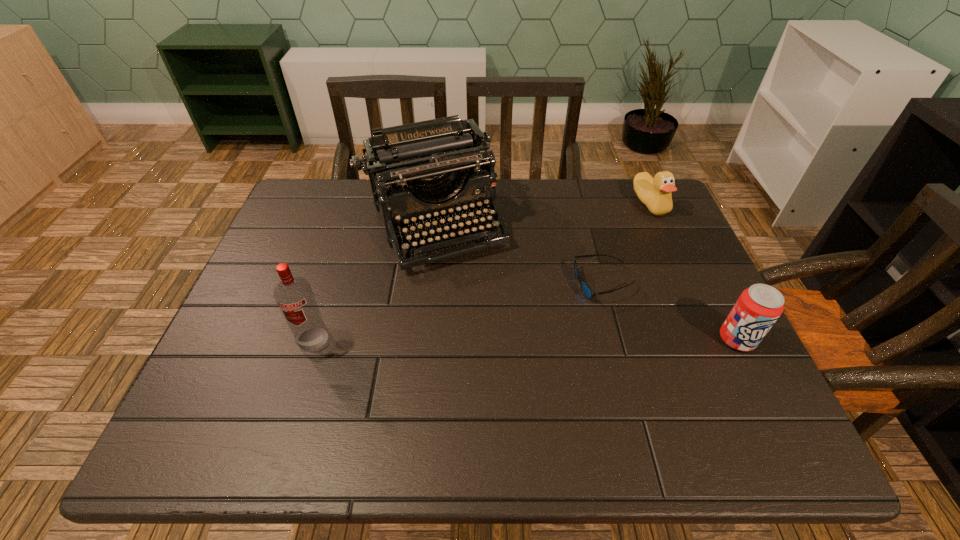
Locate an element on the screen. vacant spot on the desktop that is between the vodka and the soda can and is positioned at the beak of the second shortest object is located at coordinates (572, 339).

At what (x,y) coordinates should I click in order to perform the action: click on free space on the desktop that is between the vodka and the soda can and is positioned on the typing side of the typewriter. Please return your answer as a coordinate pair (x, y). This screenshot has height=540, width=960. Looking at the image, I should click on (491, 339).

Locate an element on the screen. free spot on the desktop that is between the vodka and the soda can and is positioned at the front of the third object from right to left showing the lenses is located at coordinates (547, 339).